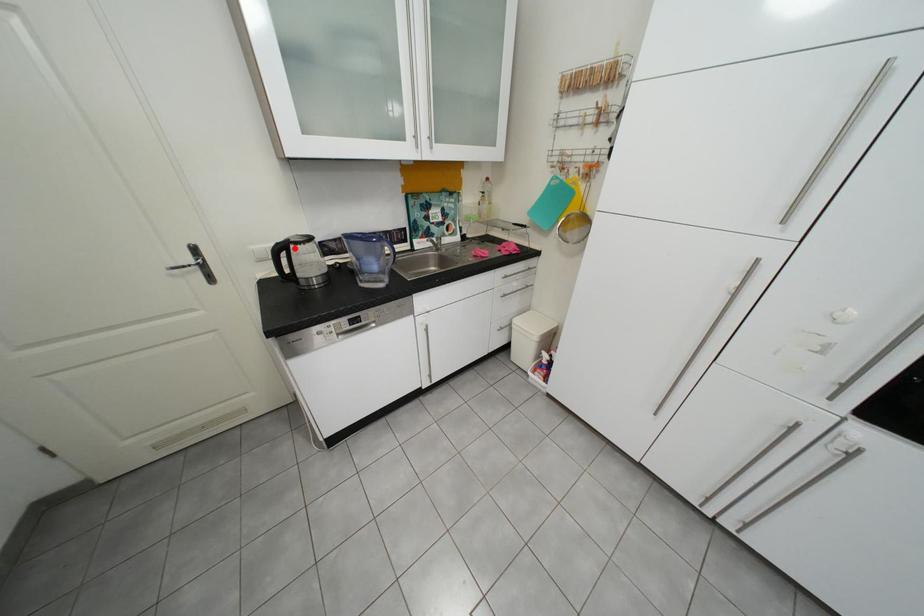
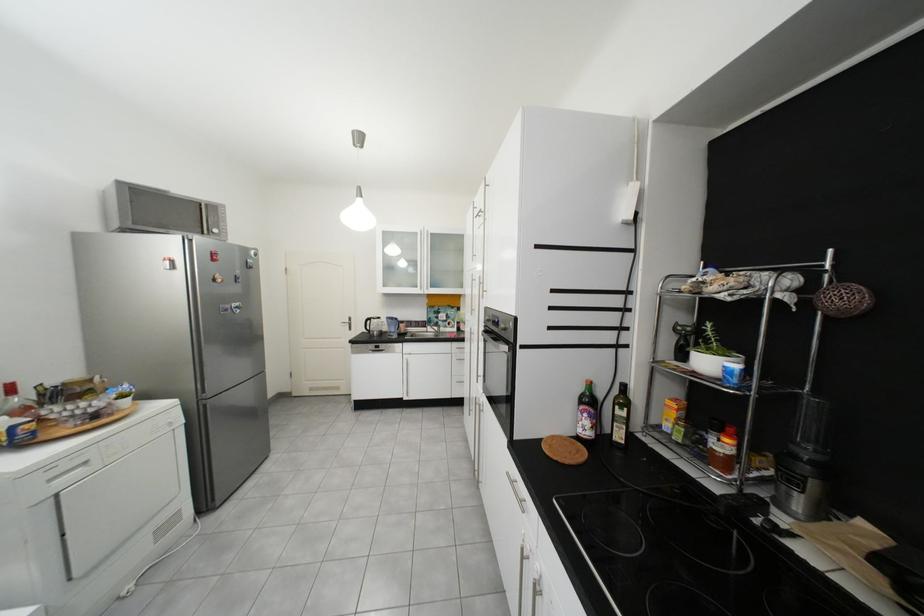
Question: A red point is marked in image1. In image2, is the corresponding 3D point closer to the camera or farther? Reply with the corresponding letter.

Choices:
 (A) The corresponding 3D point is closer.
 (B) The corresponding 3D point is farther.

Answer: (B)